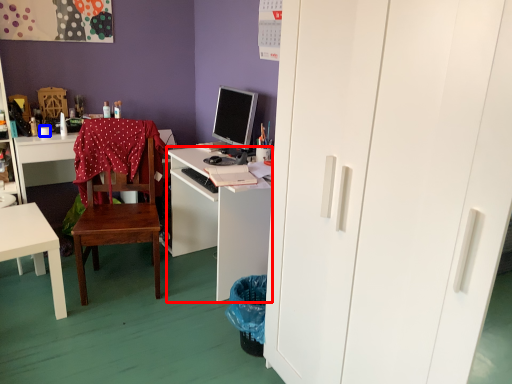
Question: Which object appears farthest to the camera in this image, desk (highlighted by a red box) or coffee cup (highlighted by a blue box)?

Choices:
 (A) desk
 (B) coffee cup

Answer: (B)